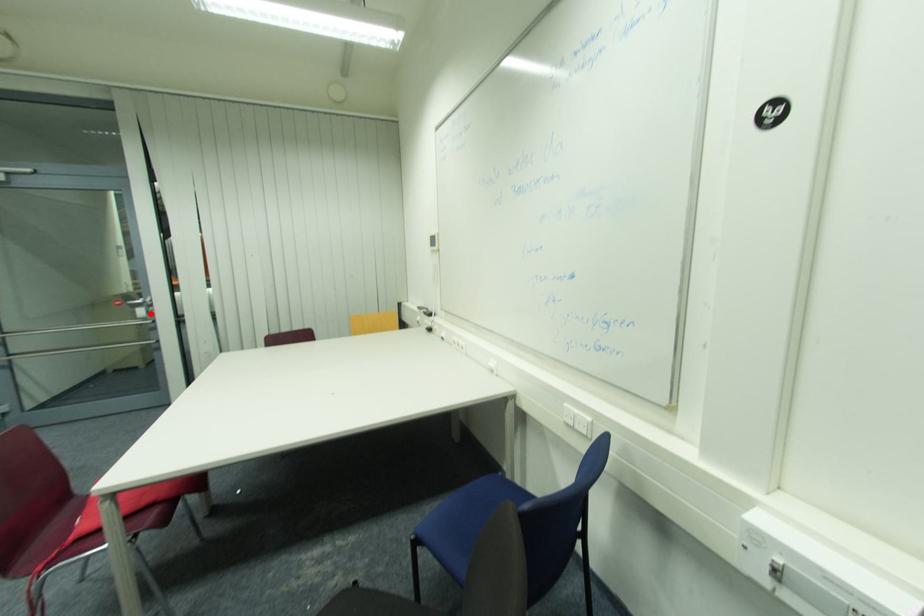
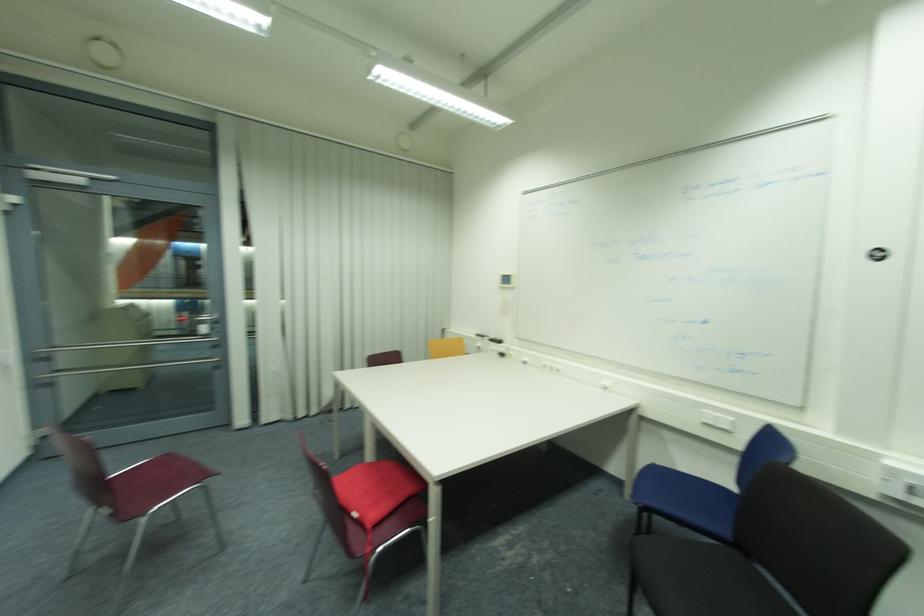
Find the pixel in the second image that matches the highlighted location in the first image.

(217, 330)